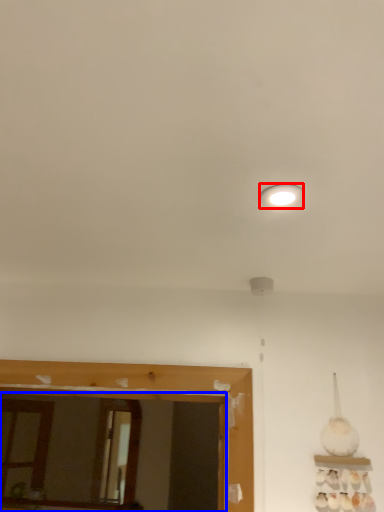
Question: Which of the following is the closest to the observer, lighting (highlighted by a red box) or mirror (highlighted by a blue box)?

Choices:
 (A) lighting
 (B) mirror

Answer: (A)